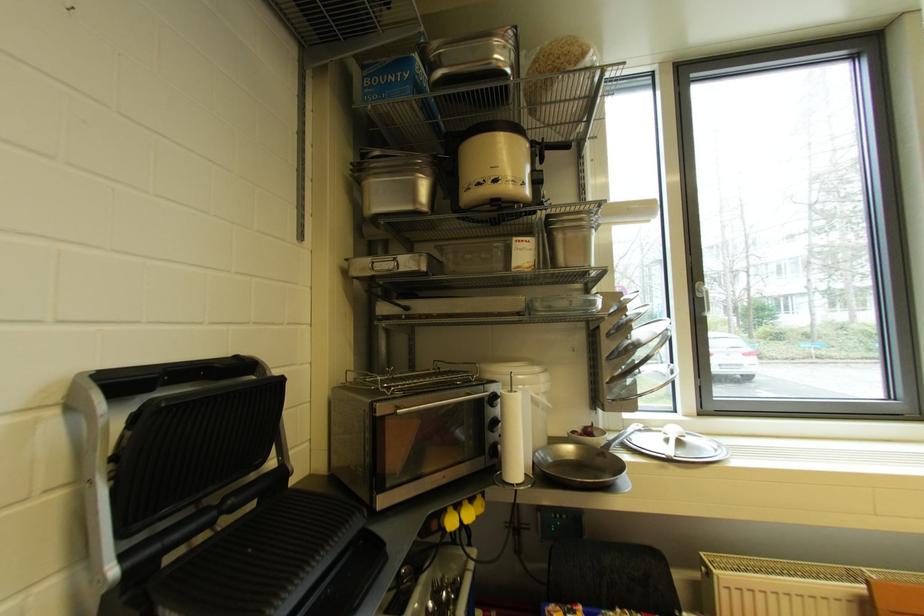
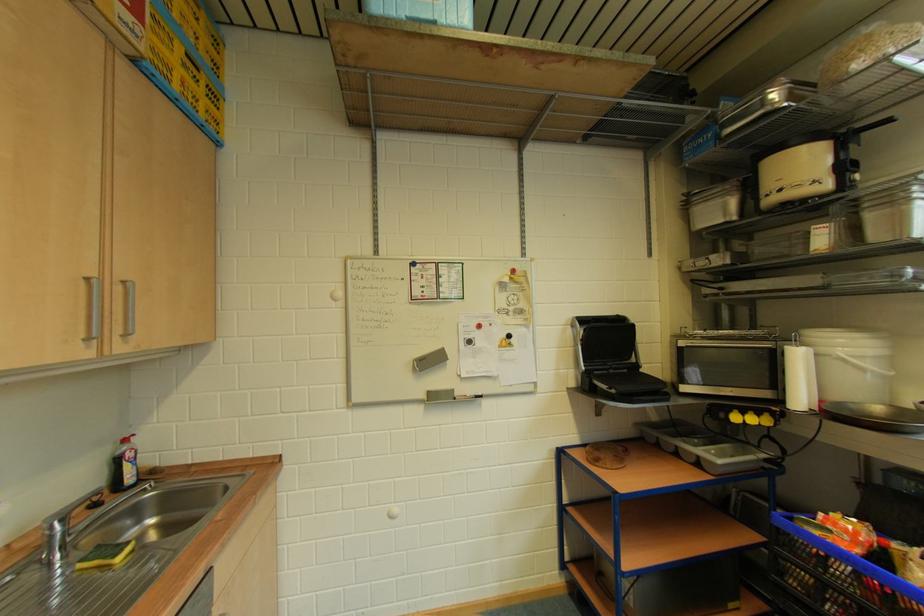
The point at (79, 411) is marked in the first image. Where is the corresponding point in the second image?

(579, 329)